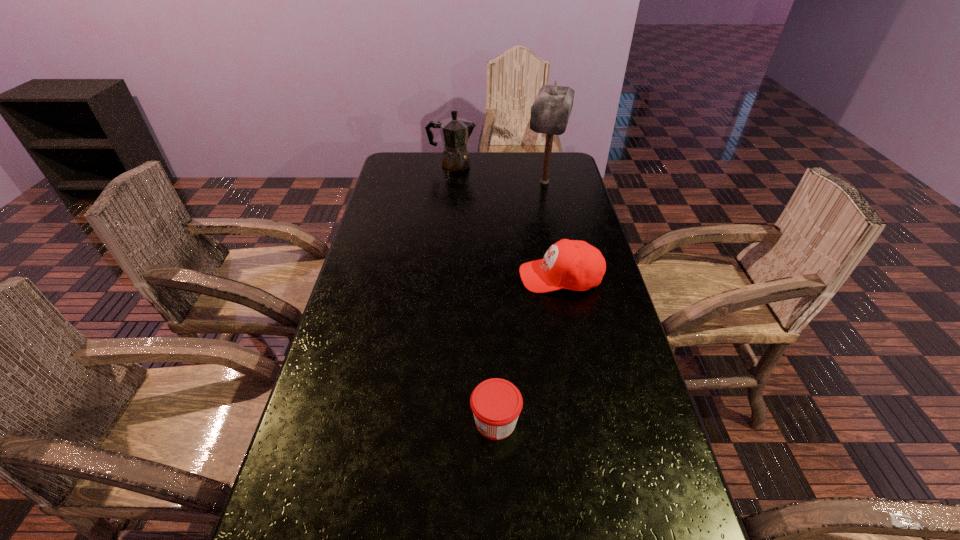
In the image, there is a desktop. At what (x,y) coordinates should I click in order to perform the action: click on vacant space at the left edge. Please return your answer as a coordinate pair (x, y). The height and width of the screenshot is (540, 960). Looking at the image, I should click on click(x=399, y=201).

Identify the location of free space at the right edge of the desktop. This screenshot has height=540, width=960. (643, 380).

Where is `vacant area between the mallet and the jam`? The image size is (960, 540). vacant area between the mallet and the jam is located at coordinates (520, 302).

This screenshot has height=540, width=960. I want to click on free space between the mallet and the coffeepot, so click(499, 173).

You are a GUI agent. You are given a task and a screenshot of the screen. Output one action in this format:
    pyautogui.click(x=<x>, y=<y>)
    Task: Click on the free point between the second tallest object and the second shortest object
    Image resolution: width=960 pixels, height=540 pixels.
    Given the screenshot: What is the action you would take?
    pyautogui.click(x=506, y=221)

Locate which object ranks third in proximity to the second tallest object. Please provide its 2D coordinates. Your answer should be formatted as a tuple, i.e. [(x, y)], where the tuple contains the x and y coordinates of a point satisfying the conditions above.

[(496, 403)]

I want to click on the closest object to the nearest object, so click(576, 265).